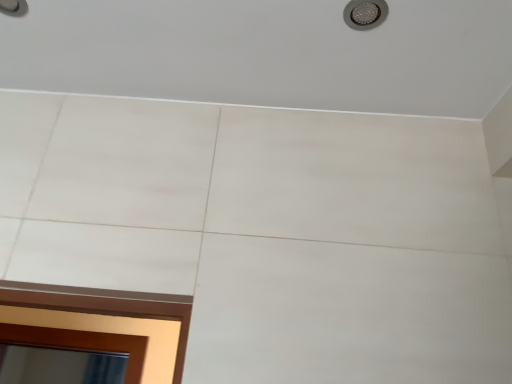
Where is `matte silver droplight at upper right`? matte silver droplight at upper right is located at coordinates (365, 14).

Describe the element at coordinates (365, 14) in the screenshot. The width and height of the screenshot is (512, 384). I see `matte silver droplight at upper right` at that location.

Find the location of a particular element. matte silver droplight at upper right is located at coordinates (365, 14).